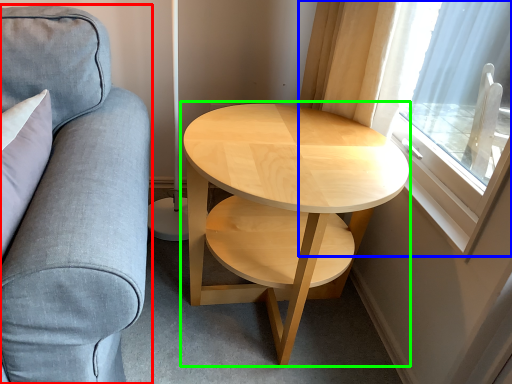
Question: Estimate the real-world distances between objects in this image. Which object is farther from studio couch (highlighted by a red box), window (highlighted by a blue box) or coffee table (highlighted by a green box)?

Choices:
 (A) window
 (B) coffee table

Answer: (A)